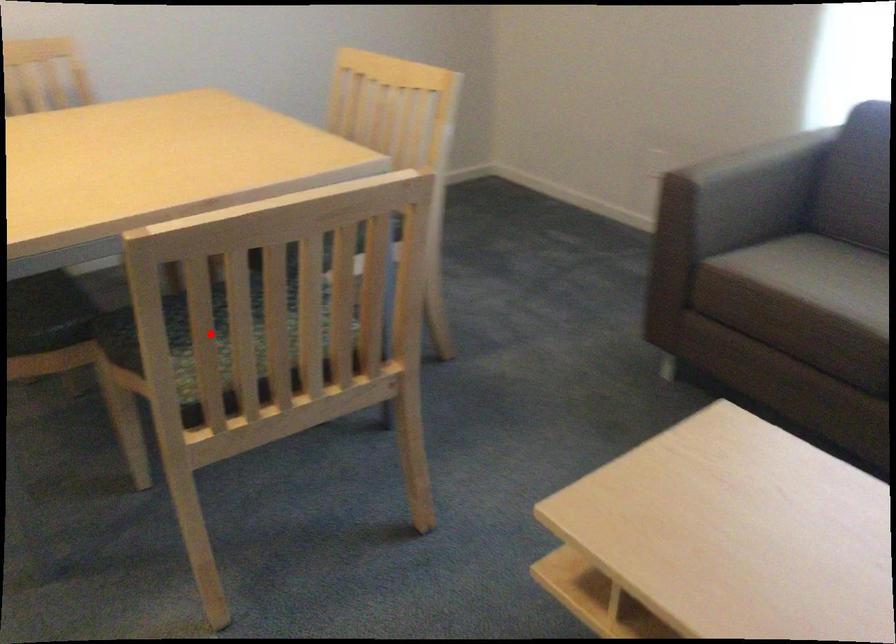
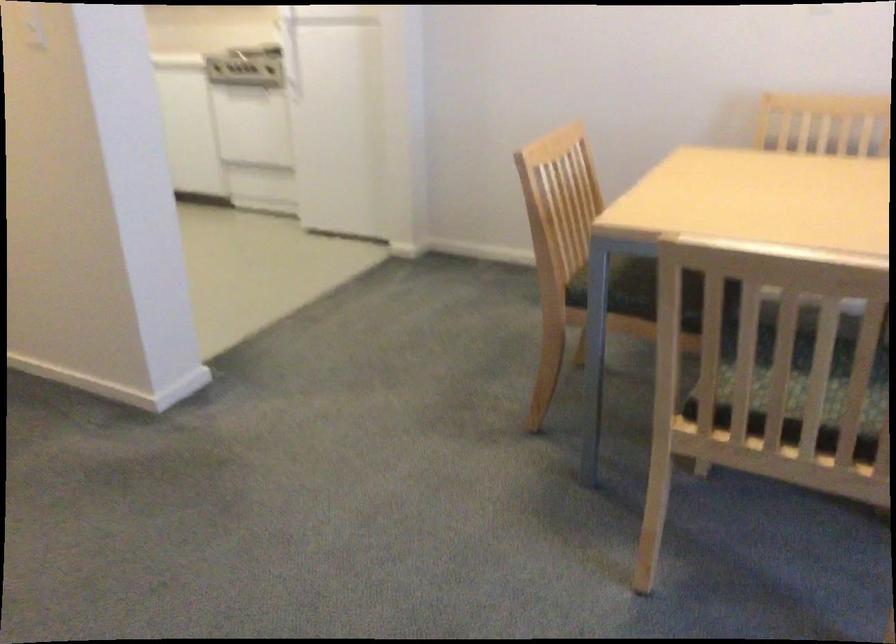
Question: I am providing you with two images of the same scene from different viewpoints. A red point is marked on the first image. Is the red point's position out of view in image 2?

Choices:
 (A) Yes
 (B) No

Answer: (A)